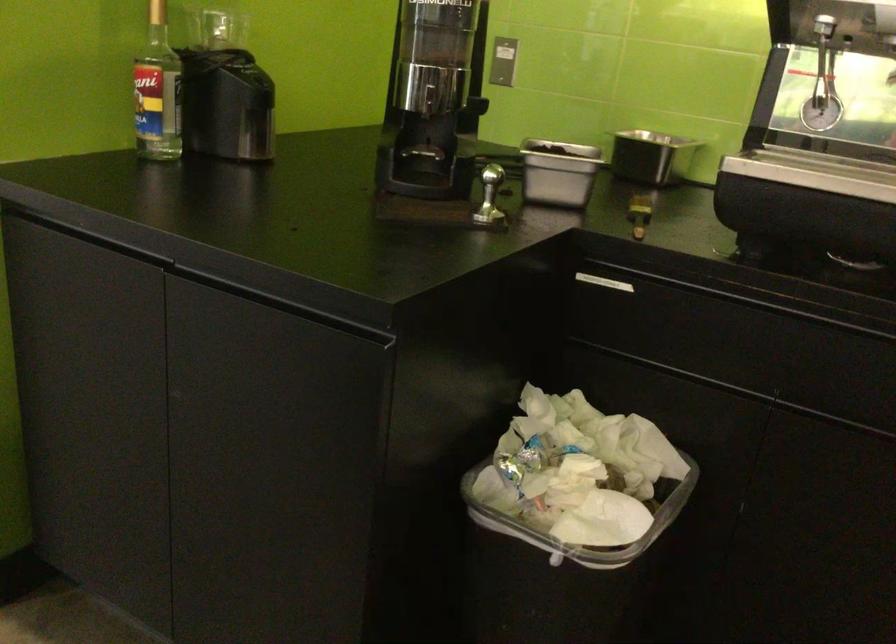
Find where to lift the clear plastic bin. Please return your answer as a coordinate pair (x, y).

(581, 524)